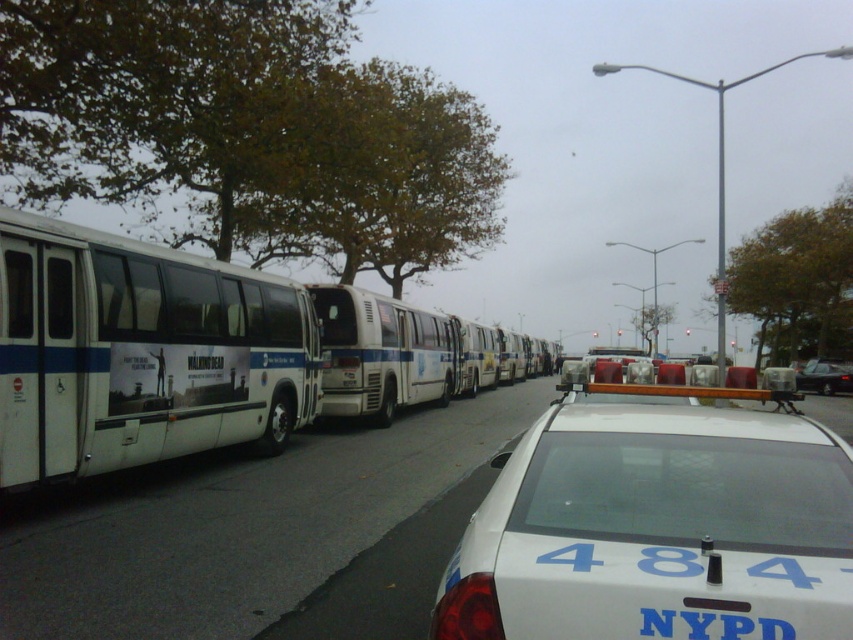
Question: Which of the following is the closest to the observer?

Choices:
 (A) metallic silver sedan at center
 (B) white matte bus at center
 (C) white glossy police car at lower right

Answer: (C)

Question: Considering the relative positions of white glossy police car at lower right and white matte bus at center in the image provided, where is white glossy police car at lower right located with respect to white matte bus at center?

Choices:
 (A) above
 (B) below

Answer: (B)

Question: Can you confirm if white matte bus at left is bigger than white matte bus at center?

Choices:
 (A) yes
 (B) no

Answer: (B)

Question: Does white glossy police car at lower right appear under white matte bus at center?

Choices:
 (A) no
 (B) yes

Answer: (B)

Question: Which point is farther to the camera?

Choices:
 (A) (843, 390)
 (B) (59, 422)

Answer: (A)

Question: Which object is the closest to the white matte bus at center?

Choices:
 (A) white matte bus at left
 (B) white glossy police car at lower right

Answer: (A)